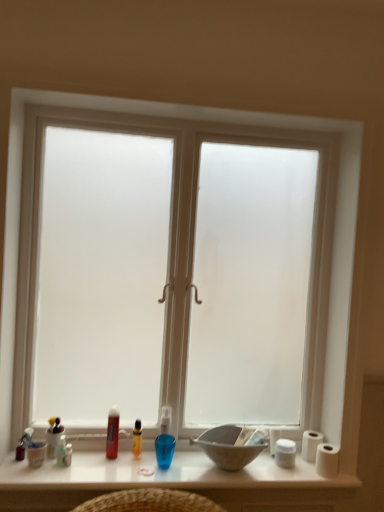
At what (x,y) coordinates should I click in order to perform the action: click on free area in between translucent plastic bottle at center, marked as the fifth toiletry in a left-to-right arrangement, and matte white cup at lower left, placed as the 2th toiletry when sorted from left to right. Please return your answer as a coordinate pair (x, y). The width and height of the screenshot is (384, 512). Looking at the image, I should click on (97, 460).